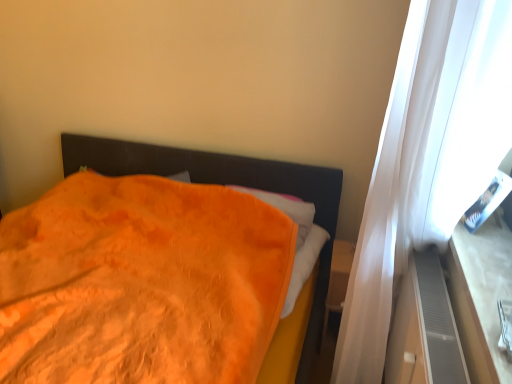
Question: Considering the relative sizes of wooden at right and gray textured dresser at right in the image provided, is wooden at right bigger than gray textured dresser at right?

Choices:
 (A) no
 (B) yes

Answer: (A)

Question: Would you say wooden at right is outside gray textured dresser at right?

Choices:
 (A) no
 (B) yes

Answer: (B)

Question: Considering the relative sizes of wooden at right and gray textured dresser at right in the image provided, is wooden at right smaller than gray textured dresser at right?

Choices:
 (A) no
 (B) yes

Answer: (B)

Question: From a real-world perspective, is wooden at right physically below gray textured dresser at right?

Choices:
 (A) no
 (B) yes

Answer: (A)

Question: Can you confirm if wooden at right is taller than gray textured dresser at right?

Choices:
 (A) no
 (B) yes

Answer: (A)

Question: Can you confirm if wooden at right is shorter than gray textured dresser at right?

Choices:
 (A) yes
 (B) no

Answer: (A)

Question: Would you consider gray textured dresser at right to be distant from orange soft blanket at left?

Choices:
 (A) yes
 (B) no

Answer: (B)

Question: Considering the relative positions of gray textured dresser at right and orange soft blanket at left in the image provided, is gray textured dresser at right to the left of orange soft blanket at left from the viewer's perspective?

Choices:
 (A) yes
 (B) no

Answer: (B)

Question: Does gray textured dresser at right have a larger size compared to orange soft blanket at left?

Choices:
 (A) yes
 (B) no

Answer: (B)

Question: Can you confirm if gray textured dresser at right is smaller than orange soft blanket at left?

Choices:
 (A) yes
 (B) no

Answer: (A)

Question: Is gray textured dresser at right at the right side of orange soft blanket at left?

Choices:
 (A) no
 (B) yes

Answer: (B)

Question: Is the surface of gray textured dresser at right in direct contact with orange soft blanket at left?

Choices:
 (A) no
 (B) yes

Answer: (A)

Question: From a real-world perspective, is gray textured dresser at right physically above wooden at right?

Choices:
 (A) no
 (B) yes

Answer: (A)